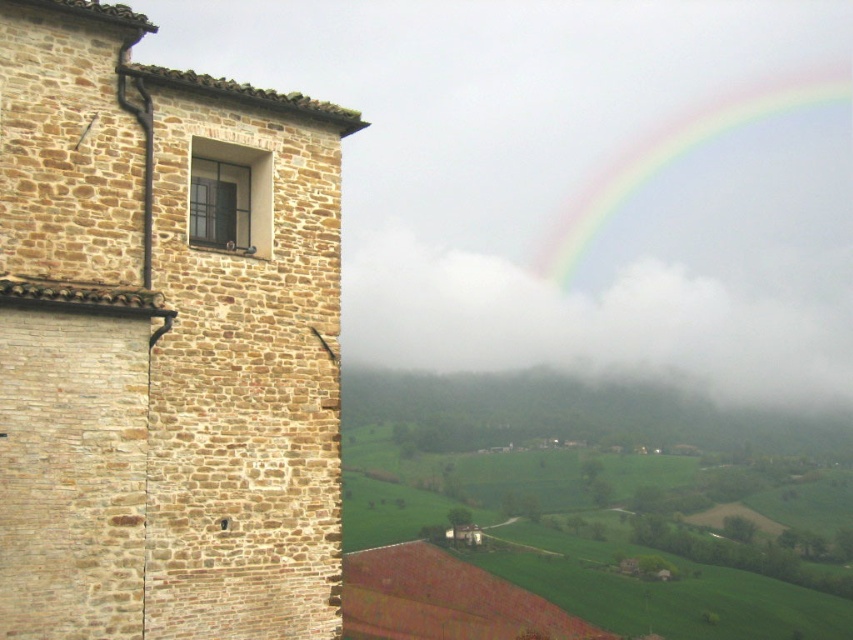
Question: Which point is farther to the camera?

Choices:
 (A) matte glass window at upper left
 (B) brown stone tower at left
 (C) white fluffy cloud at upper center

Answer: (C)

Question: Which point is closer to the camera?

Choices:
 (A) white fluffy cloud at upper center
 (B) rainbow at upper right

Answer: (A)

Question: Which point is closer to the camera taking this photo?

Choices:
 (A) (471, 349)
 (B) (229, 156)

Answer: (B)

Question: Considering the relative positions of brown stone tower at left and white fluffy cloud at upper center in the image provided, where is brown stone tower at left located with respect to white fluffy cloud at upper center?

Choices:
 (A) right
 (B) left

Answer: (B)

Question: Is white fluffy cloud at upper center wider than matte glass window at upper left?

Choices:
 (A) no
 (B) yes

Answer: (B)

Question: Is the position of rainbow at upper right less distant than that of matte glass window at upper left?

Choices:
 (A) yes
 (B) no

Answer: (B)